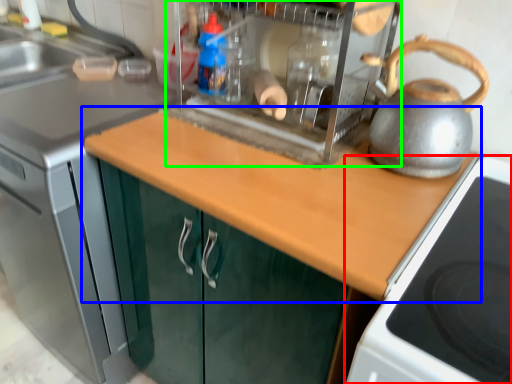
Question: Estimate the real-world distances between objects in this image. Which object is closer to gas stove (highlighted by a red box), countertop (highlighted by a blue box) or appliance (highlighted by a green box)?

Choices:
 (A) countertop
 (B) appliance

Answer: (A)